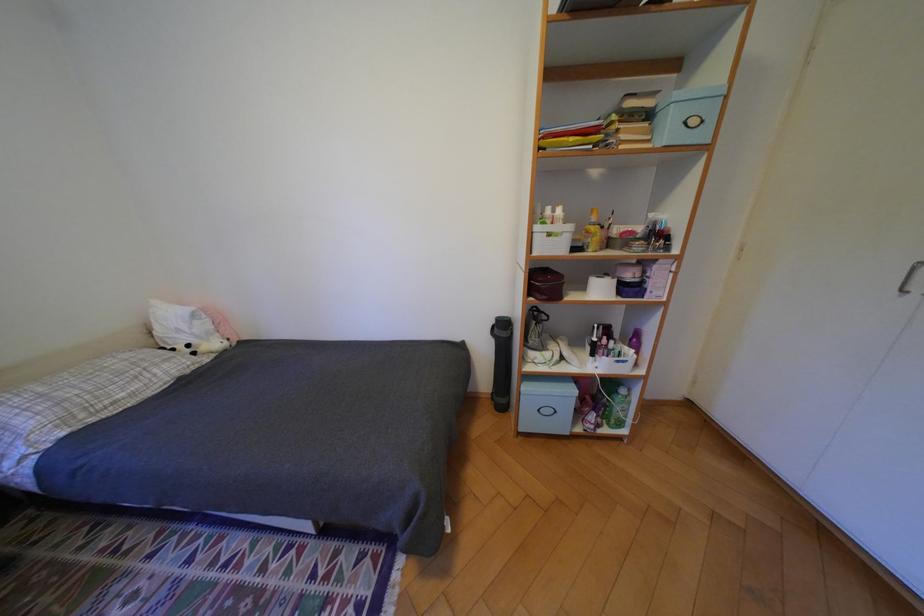
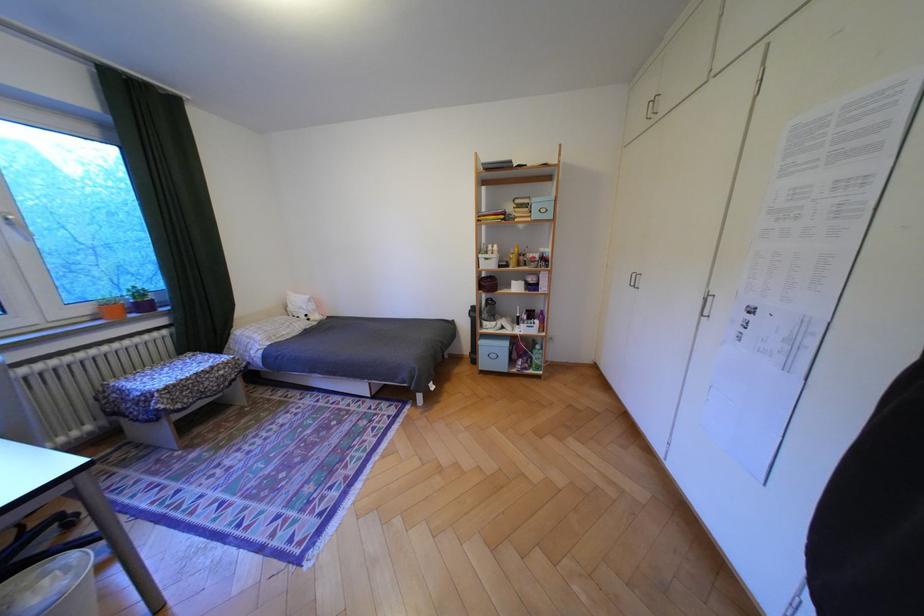
The point at [550,228] is marked in the first image. Where is the corresponding point in the second image?

(492, 256)